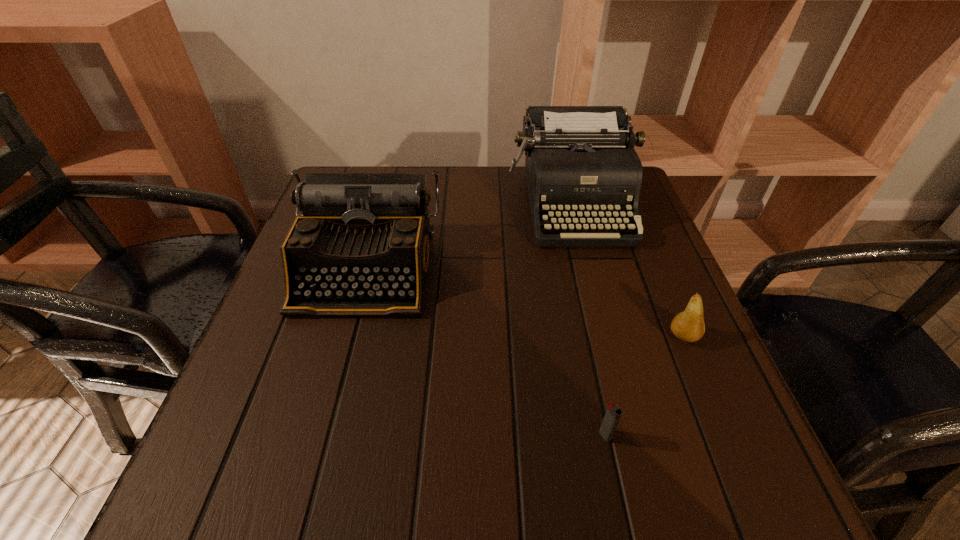
The image size is (960, 540). In order to click on the right typewriter in this screenshot , I will do `click(581, 167)`.

Where is `the left typewriter`? the left typewriter is located at coordinates (361, 246).

Locate an element on the screen. The height and width of the screenshot is (540, 960). the third tallest object is located at coordinates (688, 326).

This screenshot has width=960, height=540. Identify the location of the second nearest object. 688,326.

Image resolution: width=960 pixels, height=540 pixels. In order to click on igniter in this screenshot , I will do `click(613, 413)`.

This screenshot has height=540, width=960. In order to click on the shortest object in this screenshot , I will do [x=613, y=413].

The height and width of the screenshot is (540, 960). What are the coordinates of `vacant region located 0.200m on the front-facing side of the right typewriter` in the screenshot? It's located at (601, 318).

Image resolution: width=960 pixels, height=540 pixels. In order to click on free space located 0.100m on the keyboard of the leftmost object in this screenshot , I will do `click(340, 362)`.

Find the location of a particular element. The width and height of the screenshot is (960, 540). free region located on the back of the second nearest object is located at coordinates click(659, 276).

Find the location of a particular element. vacant space situated 0.260m on the left of the nearest object is located at coordinates (429, 435).